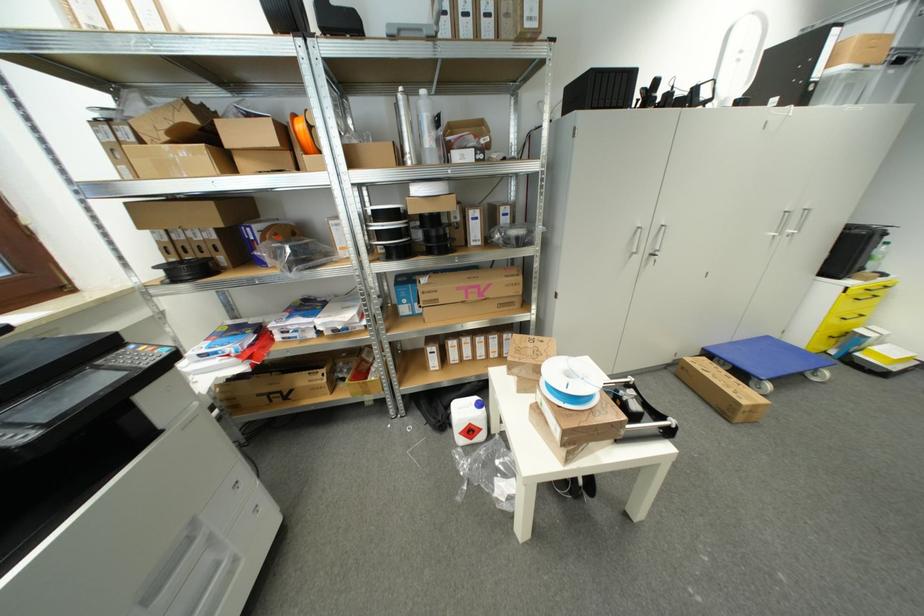
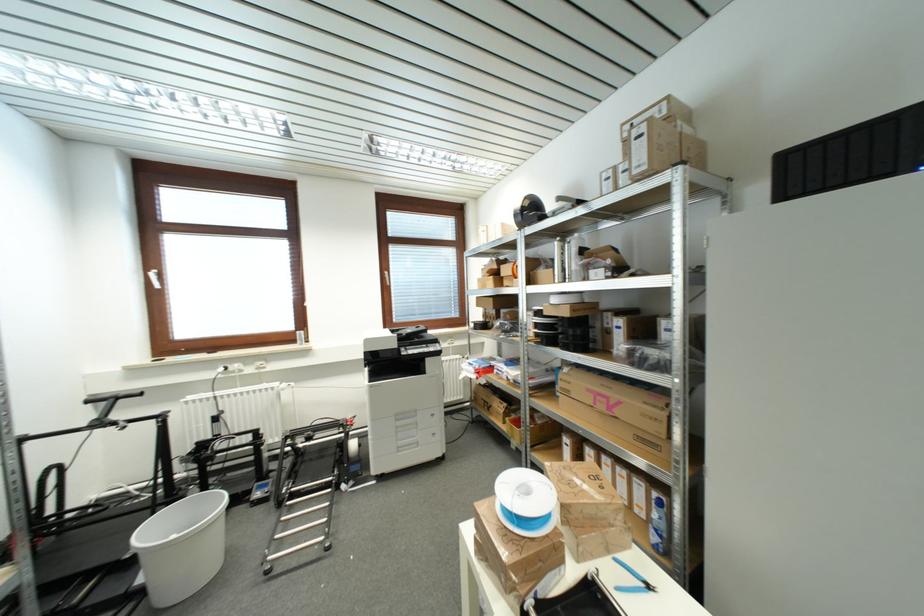
Locate, in the second image, the point that corresponds to (x=478, y=300) in the first image.

(605, 408)